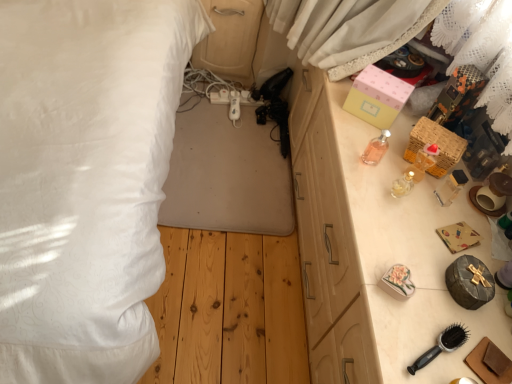
What are the coordinates of `vacant area to the right of pink glass perfume at upper right` in the screenshot? It's located at (417, 180).